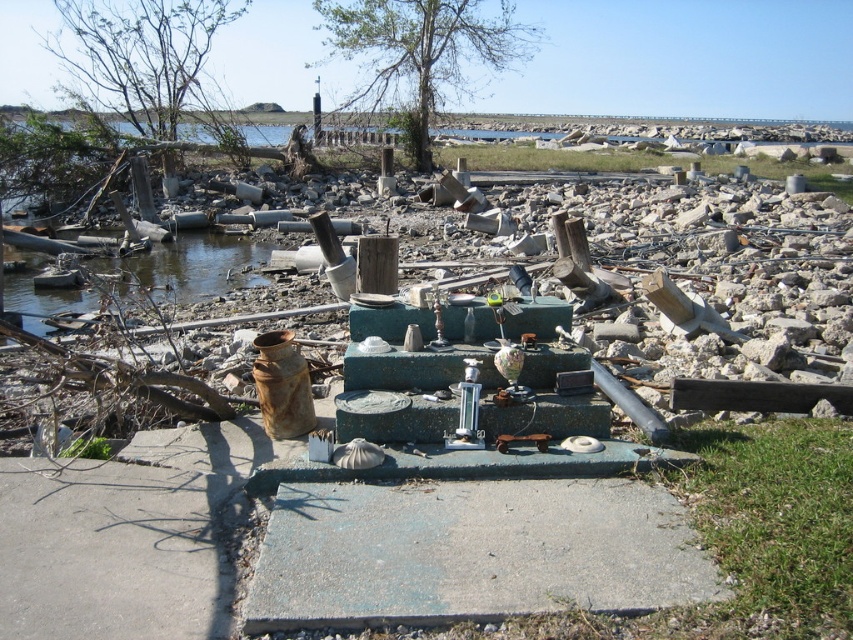
Based on the photo, you are a cleanup crew member tasked with assessing the area. You need to know which object is wider between the gray concrete slab at center and the clear water at left to determine equipment placement. Which one is wider?

The gray concrete slab at center is wider than the clear water at left according to the description, so the gray concrete slab at center is wider.